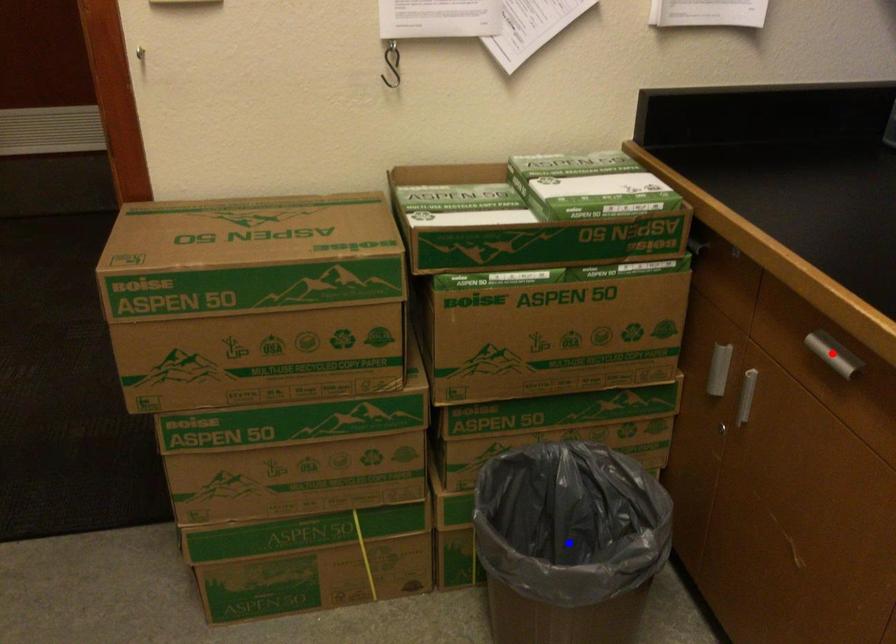
Question: Which of the two points in the image is closer to the camera?

Choices:
 (A) Blue point is closer.
 (B) Red point is closer.

Answer: (B)